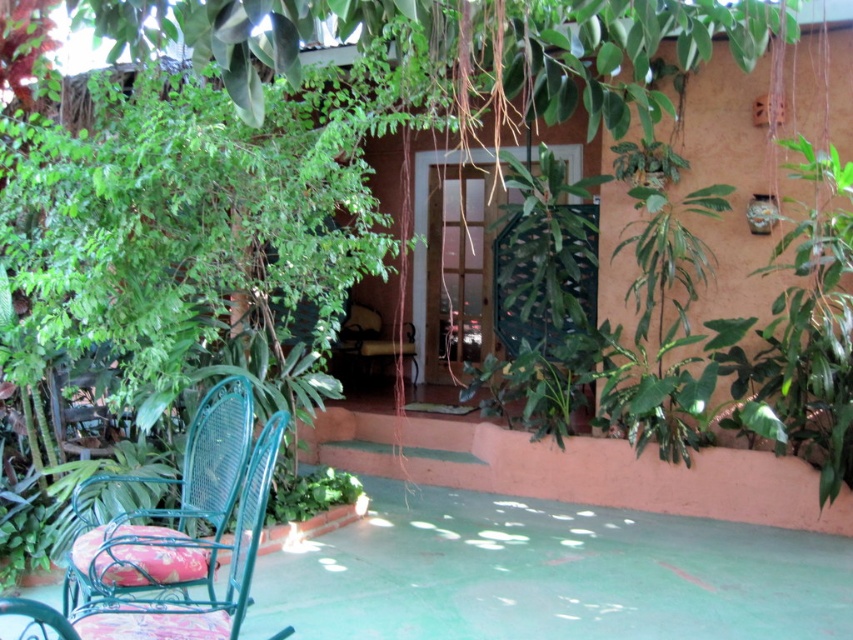
You are sitting on the metallic green chair at center and want to move to the green wicker chair at lower left. Which direction should you face to walk towards it?

The green wicker chair at lower left is to the left of metallic green chair at center, so you should face left to walk towards it.

You are a guest at this outdoor patio and want to sit down. You notice the green wicker chair at lower left and the metallic green chair at center. Which chair is taller?

The green wicker chair at lower left is much taller than the metallic green chair at center.

You are standing at the center of the patio and want to sit down on the green wicker chair at lower left. Which direction should you walk to reach it?

You should walk towards the lower left direction to reach the green wicker chair at lower left since it is located at point (167, 513).